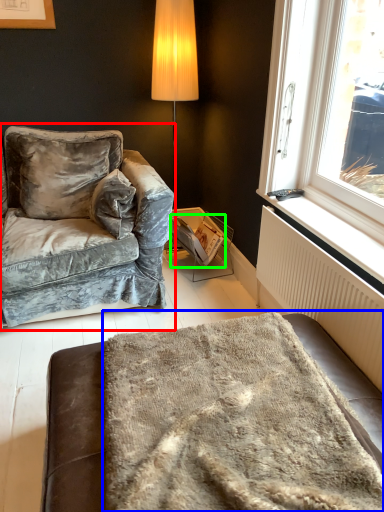
Question: Based on their relative distances, which object is nearer to studio couch (highlighted by a red box)? Choose from blanket (highlighted by a blue box) and magazine (highlighted by a green box).

Choices:
 (A) blanket
 (B) magazine

Answer: (B)